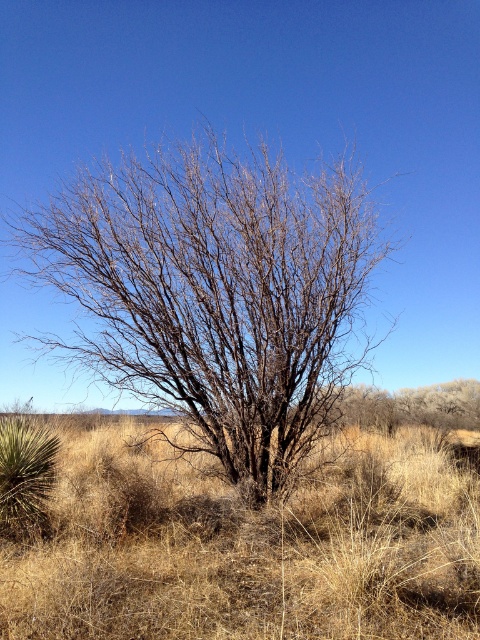
Question: Among these points, which one is farthest from the camera?

Choices:
 (A) (405, 612)
 (B) (343, 288)

Answer: (B)

Question: Can you confirm if bare branches at center is positioned above dry grass at center?

Choices:
 (A) no
 (B) yes

Answer: (B)

Question: Is bare branches at center positioned behind dry grass at center?

Choices:
 (A) yes
 (B) no

Answer: (A)

Question: Is the position of bare branches at center more distant than that of dry grass at center?

Choices:
 (A) no
 (B) yes

Answer: (B)

Question: Which point is farther to the camera?

Choices:
 (A) (286, 477)
 (B) (141, 477)

Answer: (B)